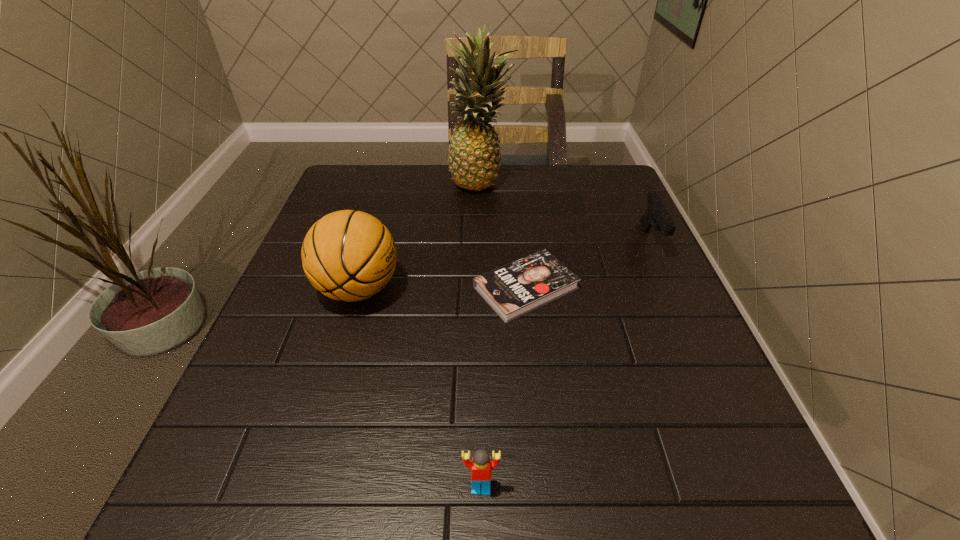
Locate an element on the screen. The width and height of the screenshot is (960, 540). free area in between the book and the rightmost object is located at coordinates (588, 265).

You are a GUI agent. You are given a task and a screenshot of the screen. Output one action in this format:
    pyautogui.click(x=<x>, y=<y>)
    Task: Click on the fourth closest object to the rightmost object
    
    Given the screenshot: What is the action you would take?
    pyautogui.click(x=481, y=465)

Locate an element on the screen. This screenshot has height=540, width=960. object that can be found as the closest to the basketball is located at coordinates (513, 290).

At what (x,y) coordinates should I click in order to perform the action: click on vacant space that satisfies the following two spatial constraints: 1. on the front side of the farthest object; 2. on the surface of the fourth shortest object near the brand logo. Please return your answer as a coordinate pair (x, y). The image size is (960, 540). Looking at the image, I should click on (482, 289).

This screenshot has height=540, width=960. I want to click on vacant space that satisfies the following two spatial constraints: 1. on the front-facing side of the rightmost object; 2. on the surface of the basketball near the brand logo, so click(x=673, y=289).

At what (x,y) coordinates should I click in order to perform the action: click on free region that satisfies the following two spatial constraints: 1. on the front-facing side of the rightmost object; 2. on the surface of the second tallest object near the brand logo. Please return your answer as a coordinate pair (x, y). Looking at the image, I should click on (673, 289).